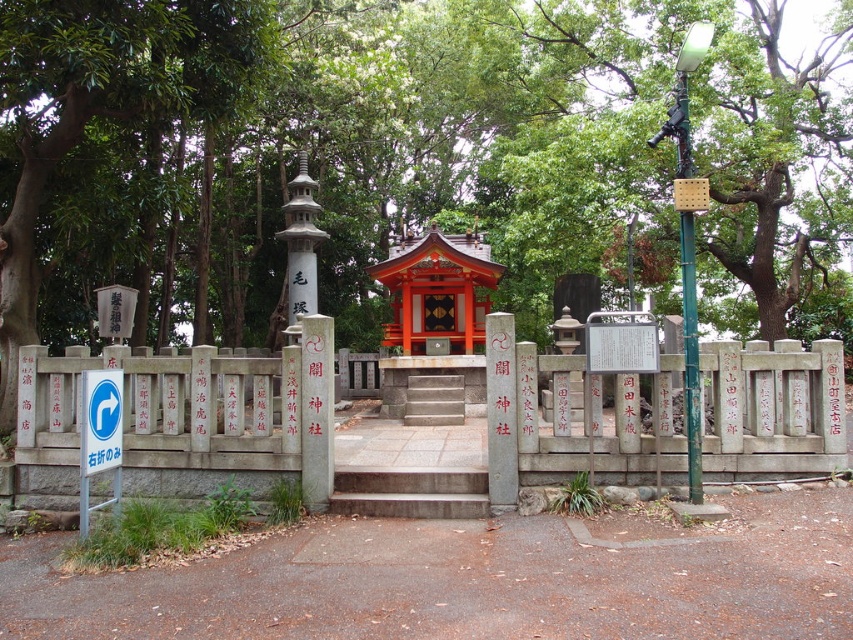
You are standing at the entrance of the shrine and want to locate the green leafy tree at center. According to the coordinates provided, where should you look relative to the torii gate?

The green leafy tree at center is located at coordinates point (392, 148), which places it to the left of the torii gate.

You are standing at the entrance of a traditional Japanese shrine and see the green leafy tree at center and the gray stone stairs at center. From your perspective, which object is positioned to the right side?

The green leafy tree at center is positioned to the right of the gray stone stairs at center.